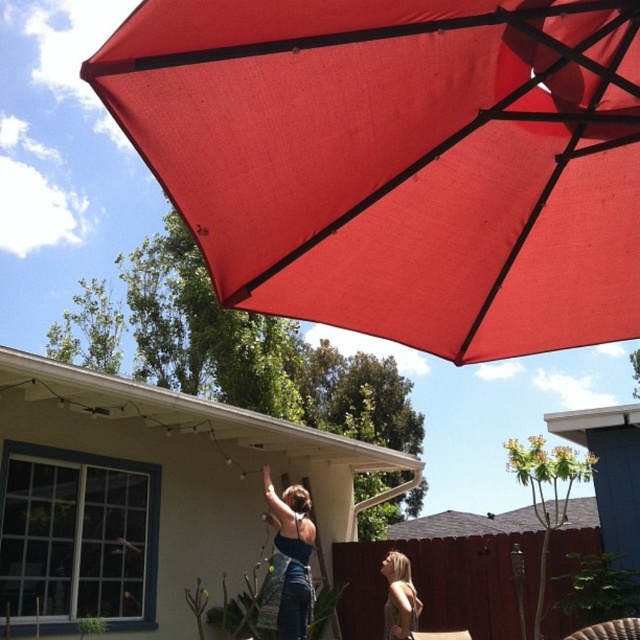
Does red matte umbrella at upper center have a lesser height compared to golden brown hair at lower right?

No, red matte umbrella at upper center is not shorter than golden brown hair at lower right.

Who is higher up, red matte umbrella at upper center or golden brown hair at lower right?

red matte umbrella at upper center is above.

The image size is (640, 640). What do you see at coordinates (397, 161) in the screenshot?
I see `red matte umbrella at upper center` at bounding box center [397, 161].

What are the coordinates of `red matte umbrella at upper center` in the screenshot? It's located at (397, 161).

Can you confirm if red matte umbrella at upper center is smaller than matte blue dress at center?

Incorrect, red matte umbrella at upper center is not smaller in size than matte blue dress at center.

Can you confirm if red matte umbrella at upper center is positioned to the left of matte blue dress at center?

Incorrect, red matte umbrella at upper center is not on the left side of matte blue dress at center.

Find the location of a particular element. The height and width of the screenshot is (640, 640). red matte umbrella at upper center is located at coordinates (397, 161).

Does matte blue dress at center lie behind golden brown hair at lower right?

Yes, matte blue dress at center is further from the viewer.

Is point (305, 634) less distant than point (404, 577)?

Yes, point (305, 634) is closer to viewer.

Identify the location of matte blue dress at center. (291, 554).